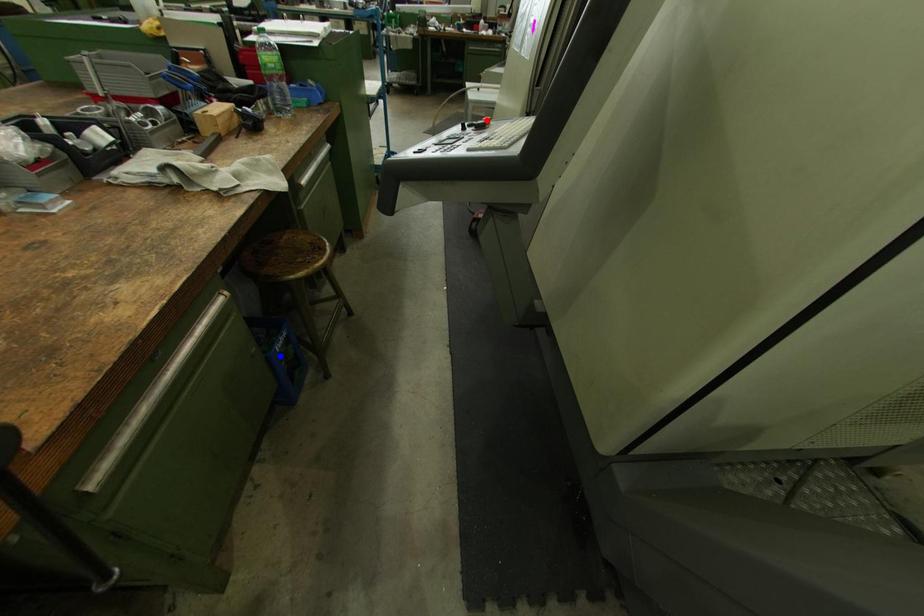
Question: In the image, two points are highlighted. Which point is nearer to the camera? Reply with the corresponding letter.

Choices:
 (A) blue point
 (B) red point

Answer: (B)